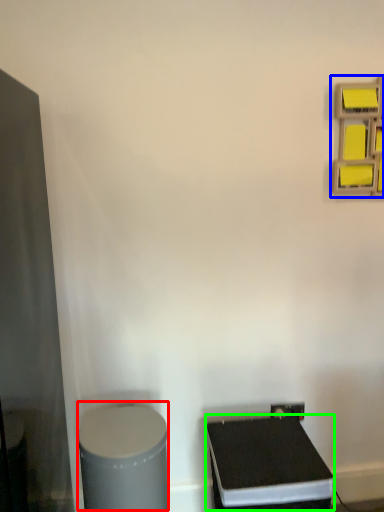
Question: Estimate the real-world distances between objects in this image. Which object is closer to wide (highlighted by a red box), shelf (highlighted by a blue box) or wide (highlighted by a green box)?

Choices:
 (A) shelf
 (B) wide

Answer: (B)